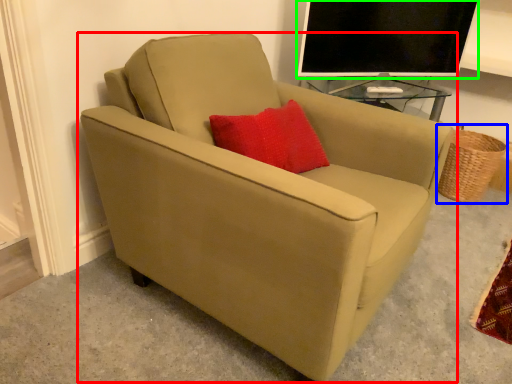
Question: Considering the real-world distances, which object is farthest from chair (highlighted by a red box)? basket (highlighted by a blue box) or television (highlighted by a green box)?

Choices:
 (A) basket
 (B) television

Answer: (A)